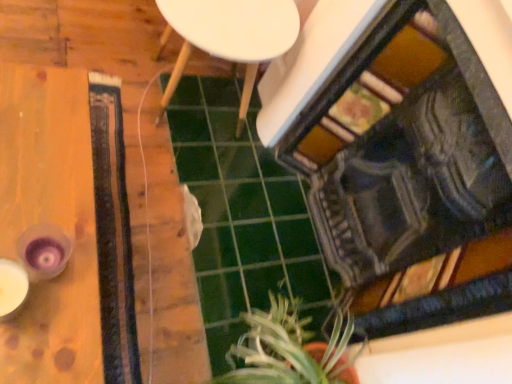
What are the coordinates of `vacant area situated to the left side of white matte side table at center` in the screenshot? It's located at (81, 27).